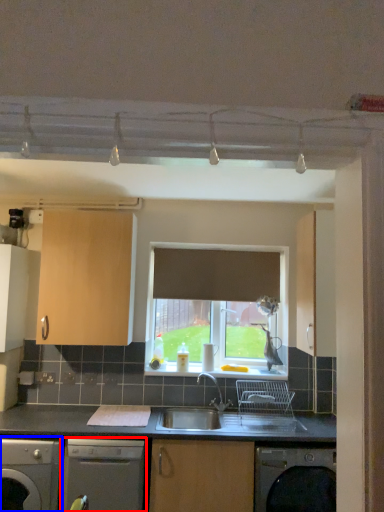
Question: Which of the following is the closest to the observer, dishwasher (highlighted by a red box) or dishwasher (highlighted by a blue box)?

Choices:
 (A) dishwasher
 (B) dishwasher

Answer: (B)